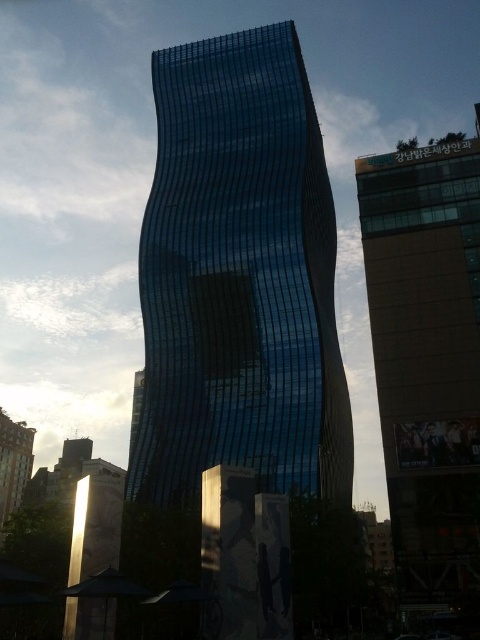
You are standing in front of the modern skyscraper and want to determine the relative positions of two points marked on the building. The first point is at coordinate point (x=423, y=470) and the second is at point (x=19, y=456). Which point is closer to your viewpoint?

Point (x=423, y=470) is closer to the viewer than point (x=19, y=456).